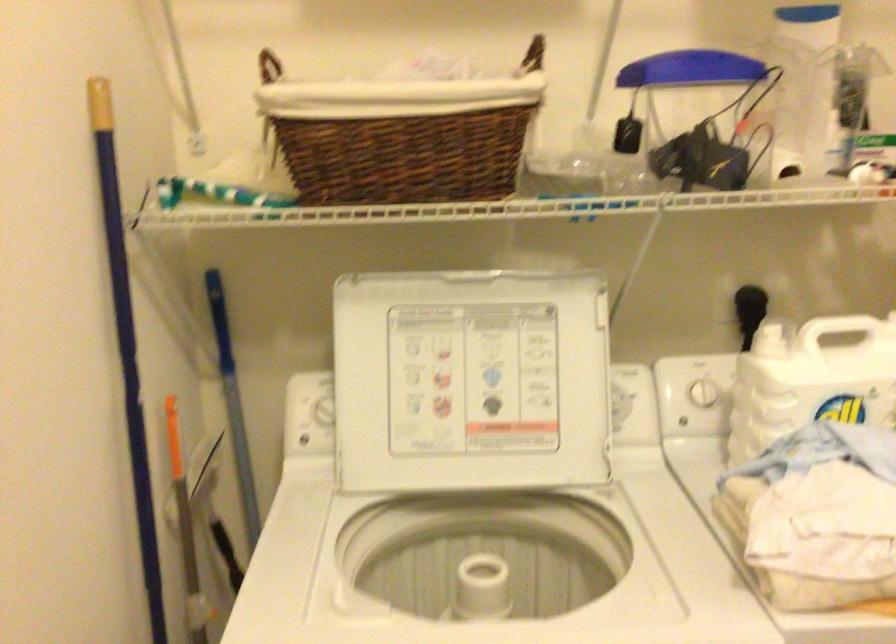
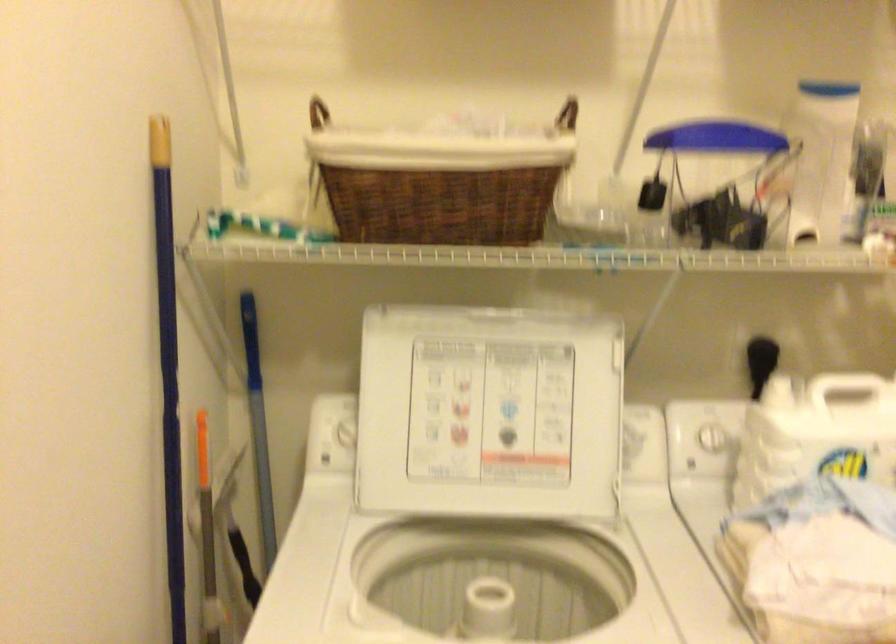
In the second image, find the point that corresponds to pixel 126 351 in the first image.

(168, 366)